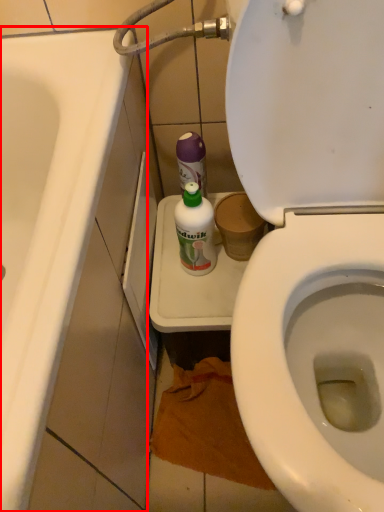
Question: From the image's perspective, where is bath (annotated by the red box) located in relation to cleaning product in the image?

Choices:
 (A) above
 (B) below

Answer: (B)